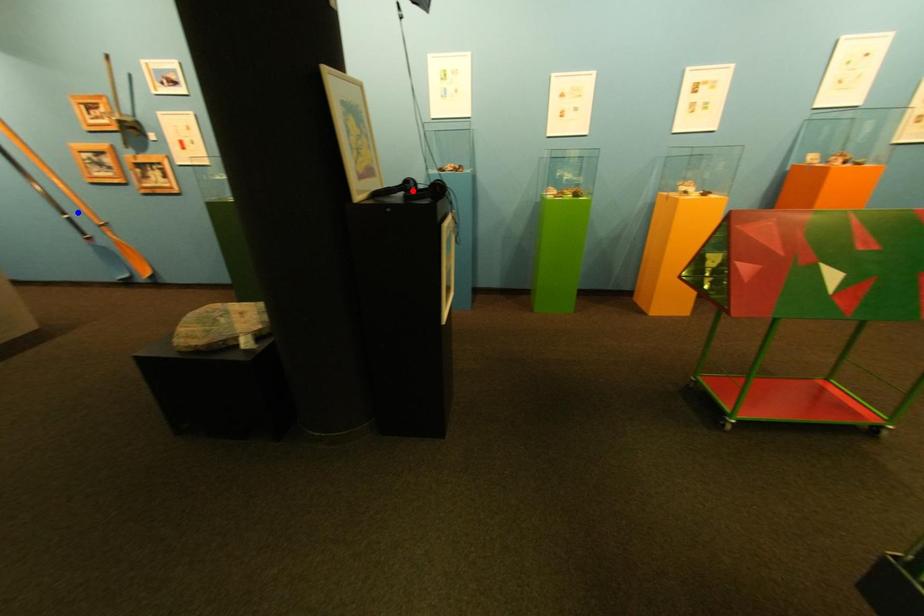
Question: In the image, two points are highlighted. Which point is nearer to the camera? Reply with the corresponding letter.

Choices:
 (A) blue point
 (B) red point

Answer: (B)